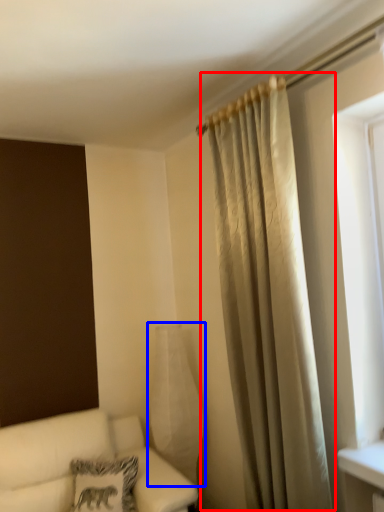
Question: Among these objects, which one is farthest to the camera, curtain (highlighted by a red box) or glass vase (highlighted by a blue box)?

Choices:
 (A) curtain
 (B) glass vase

Answer: (B)